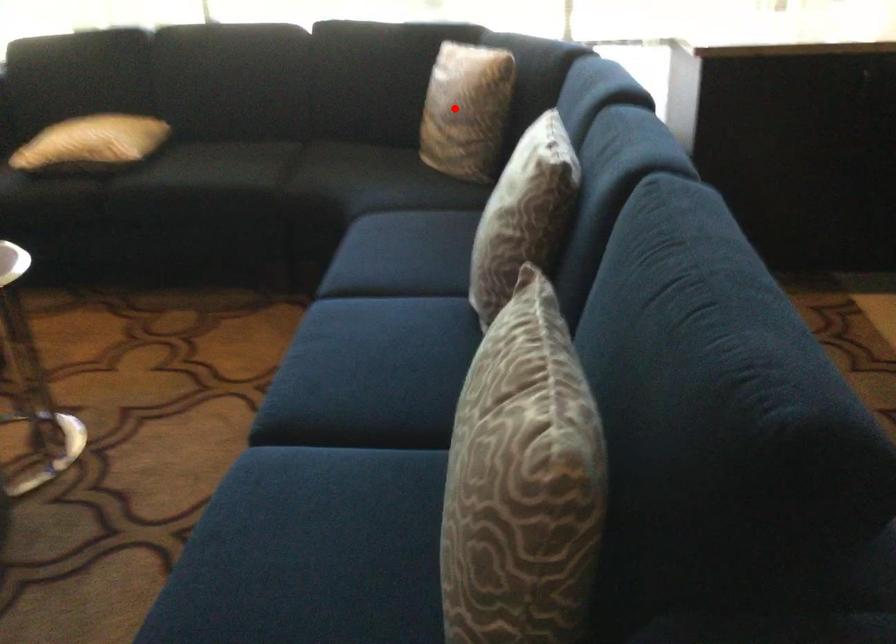
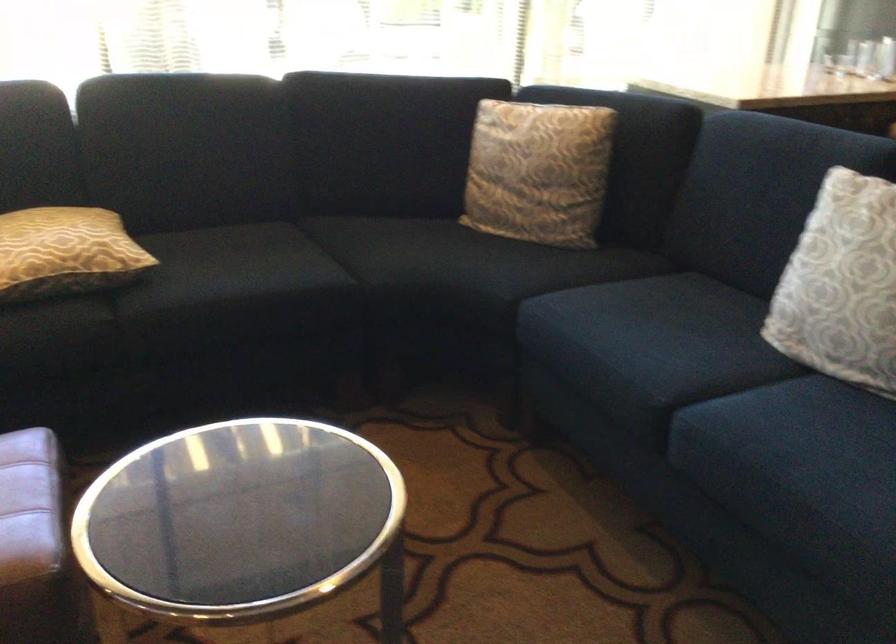
Find the pixel in the second image that matches the highlighted location in the first image.

(538, 172)